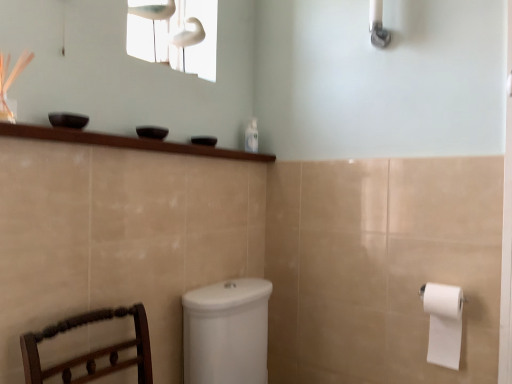
I want to click on clear plastic bottle at upper center, so click(251, 136).

What do you see at coordinates (251, 136) in the screenshot? The image size is (512, 384). I see `clear plastic bottle at upper center` at bounding box center [251, 136].

The image size is (512, 384). What are the coordinates of `clear plastic bottle at upper center` in the screenshot? It's located at (251, 136).

From the image's perspective, is white glossy shower head at upper right located above or below white matte toilet paper at right?

white glossy shower head at upper right is above white matte toilet paper at right.

Between white glossy shower head at upper right and white matte toilet paper at right, which one is positioned behind?

white glossy shower head at upper right is behind.

Is the surface of white glossy shower head at upper right in direct contact with white matte toilet paper at right?

No.

Which is more to the right, white glossy shower head at upper right or white matte toilet paper at right?

white matte toilet paper at right.

Is clear plastic bottle at upper center wider than white glossy shower head at upper right?

In fact, clear plastic bottle at upper center might be narrower than white glossy shower head at upper right.

Could you tell me if clear plastic bottle at upper center is turned towards white glossy shower head at upper right?

No, clear plastic bottle at upper center is not facing towards white glossy shower head at upper right.

Does point (256, 130) lie behind point (369, 22)?

Yes, it is.

Is white glossy shower head at upper right surrounded by clear plastic bottle at upper center?

Definitely not — white glossy shower head at upper right is not inside clear plastic bottle at upper center.

From a real-world perspective, between white glossy window screen at upper center and clear plastic bottle at upper center, who is vertically higher?

From a 3D spatial view, white glossy window screen at upper center is above.

How distant is white glossy window screen at upper center from clear plastic bottle at upper center?

white glossy window screen at upper center is 53.83 centimeters away from clear plastic bottle at upper center.

Is white glossy window screen at upper center oriented towards clear plastic bottle at upper center?

No, white glossy window screen at upper center is not oriented towards clear plastic bottle at upper center.

Considering the sizes of objects white glossy shower head at upper right and clear plastic bottle at upper center in the image provided, who is smaller, white glossy shower head at upper right or clear plastic bottle at upper center?

clear plastic bottle at upper center is smaller.

Is white glossy shower head at upper right shorter than clear plastic bottle at upper center?

In fact, white glossy shower head at upper right may be taller than clear plastic bottle at upper center.

How different are the orientations of white glossy shower head at upper right and clear plastic bottle at upper center in degrees?

88.7 degrees separate the facing orientations of white glossy shower head at upper right and clear plastic bottle at upper center.

The width and height of the screenshot is (512, 384). What are the coordinates of `shower above the clear plastic bottle at upper center (from a real-world perspective)` in the screenshot? It's located at click(378, 25).

Identify the location of toilet paper lying on the right of white glossy window screen at upper center. (443, 323).

From a real-world perspective, is white glossy window screen at upper center above or below white matte toilet paper at right?

In terms of real-world spatial position, white glossy window screen at upper center is above white matte toilet paper at right.

Between white glossy window screen at upper center and white matte toilet paper at right, which one has smaller size?

With smaller size is white matte toilet paper at right.

Is clear plastic bottle at upper center smaller than white matte toilet paper at right?

Indeed, clear plastic bottle at upper center has a smaller size compared to white matte toilet paper at right.

Is white matte toilet paper at right at the back of clear plastic bottle at upper center?

That's not correct — clear plastic bottle at upper center is not looking away from white matte toilet paper at right.

Consider the image. Which object is further away from the camera, clear plastic bottle at upper center or white matte toilet paper at right?

clear plastic bottle at upper center is behind.

Considering the positions of points (253, 126) and (447, 347), is point (253, 126) farther from camera compared to point (447, 347)?

Yes, point (253, 126) is behind point (447, 347).

Is white glossy window screen at upper center inside clear plastic bottle at upper center?

That's incorrect, white glossy window screen at upper center is not inside clear plastic bottle at upper center.

Is clear plastic bottle at upper center not close to white glossy window screen at upper center?

No.

How different are the orientations of clear plastic bottle at upper center and white glossy window screen at upper center in degrees?

41 degrees separate the facing orientations of clear plastic bottle at upper center and white glossy window screen at upper center.

In the scene shown: From a real-world perspective, who is located lower, clear plastic bottle at upper center or white glossy window screen at upper center?

In real-world perspective, clear plastic bottle at upper center is lower.

I want to click on shower above the white matte toilet paper at right (from a real-world perspective), so click(378, 25).

You are a GUI agent. You are given a task and a screenshot of the screen. Output one action in this format:
    pyautogui.click(x=<x>, y=<y>)
    Task: Click on the toiletry that is on the left side of white glossy shower head at upper right
    The width and height of the screenshot is (512, 384).
    Given the screenshot: What is the action you would take?
    pyautogui.click(x=251, y=136)

When comparing their distances from clear plastic bottle at upper center, does white matte toilet paper at right or white glossy window screen at upper center seem further?

white matte toilet paper at right is further to clear plastic bottle at upper center.

Which object lies further to the anchor point white matte toilet paper at right, white glossy window screen at upper center or white glossy shower head at upper right?

white glossy window screen at upper center is further to white matte toilet paper at right.

Which object lies nearer to the anchor point white glossy shower head at upper right, white matte toilet paper at right or white glossy window screen at upper center?

The object closer to white glossy shower head at upper right is white glossy window screen at upper center.

From the picture: Which object lies further to the anchor point white matte toilet paper at right, clear plastic bottle at upper center or white glossy window screen at upper center?

white glossy window screen at upper center is further to white matte toilet paper at right.

Based on their spatial positions, is clear plastic bottle at upper center or white glossy window screen at upper center closer to white glossy shower head at upper right?

clear plastic bottle at upper center is closer to white glossy shower head at upper right.

Based on their spatial positions, is white matte toilet paper at right or clear plastic bottle at upper center further from white glossy window screen at upper center?

Among the two, white matte toilet paper at right is located further to white glossy window screen at upper center.

Looking at the image, which one is located closer to white glossy window screen at upper center, clear plastic bottle at upper center or white matte toilet paper at right?

clear plastic bottle at upper center is closer to white glossy window screen at upper center.

Based on their spatial positions, is white glossy window screen at upper center or white glossy shower head at upper right further from clear plastic bottle at upper center?

white glossy shower head at upper right is further to clear plastic bottle at upper center.

Where is `toiletry situated between white glossy window screen at upper center and white glossy shower head at upper right from left to right`? The height and width of the screenshot is (384, 512). toiletry situated between white glossy window screen at upper center and white glossy shower head at upper right from left to right is located at coordinates (251, 136).

Locate an element on the screen. The image size is (512, 384). toiletry between white glossy window screen at upper center and white matte toilet paper at right from top to bottom is located at coordinates (251, 136).

Locate an element on the screen. window screen that lies between white glossy shower head at upper right and white matte toilet paper at right from top to bottom is located at coordinates (175, 34).

At what (x,y) coordinates should I click in order to perform the action: click on toiletry between white glossy shower head at upper right and white matte toilet paper at right vertically. Please return your answer as a coordinate pair (x, y). This screenshot has height=384, width=512. Looking at the image, I should click on (251, 136).